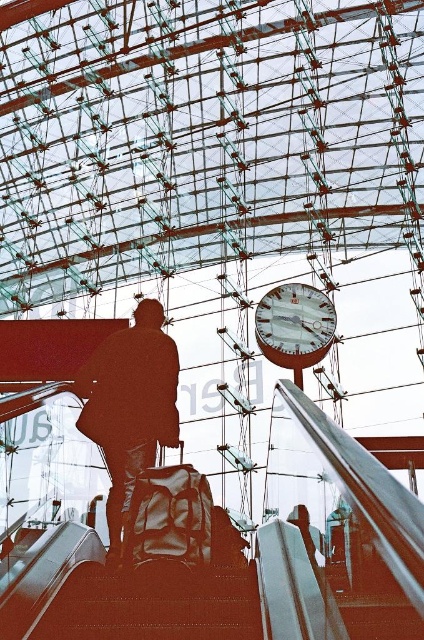
Is silhouette fabric bag at center taller than metallic silver clock at upper center?

No, silhouette fabric bag at center is not taller than metallic silver clock at upper center.

Which of these two, silhouette fabric bag at center or metallic silver clock at upper center, stands taller?

metallic silver clock at upper center

Who is more forward, (167,410) or (284,298)?

Point (167,410) is in front.

The width and height of the screenshot is (424, 640). Identify the location of silhouette fabric bag at center. (130, 404).

Identify the location of shiny metallic stairs at lower center. The height and width of the screenshot is (640, 424). coord(155,604).

Can you confirm if shiny metallic stairs at lower center is smaller than metallic silver clock at upper center?

Yes, shiny metallic stairs at lower center is smaller than metallic silver clock at upper center.

Who is more forward, [194,621] or [312,328]?

Point [194,621] is more forward.

Locate an element on the screen. shiny metallic stairs at lower center is located at coordinates coord(155,604).

Does shiny metallic stairs at lower center have a greater height compared to silhouette fabric bag at center?

In fact, shiny metallic stairs at lower center may be shorter than silhouette fabric bag at center.

Is shiny metallic stairs at lower center positioned behind silhouette fabric bag at center?

No.

This screenshot has width=424, height=640. I want to click on shiny metallic stairs at lower center, so click(x=155, y=604).